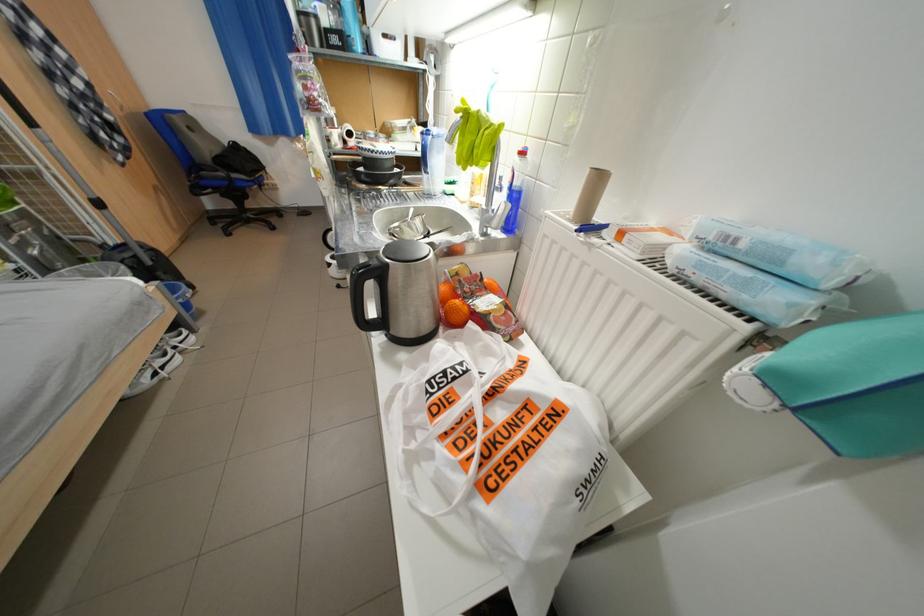
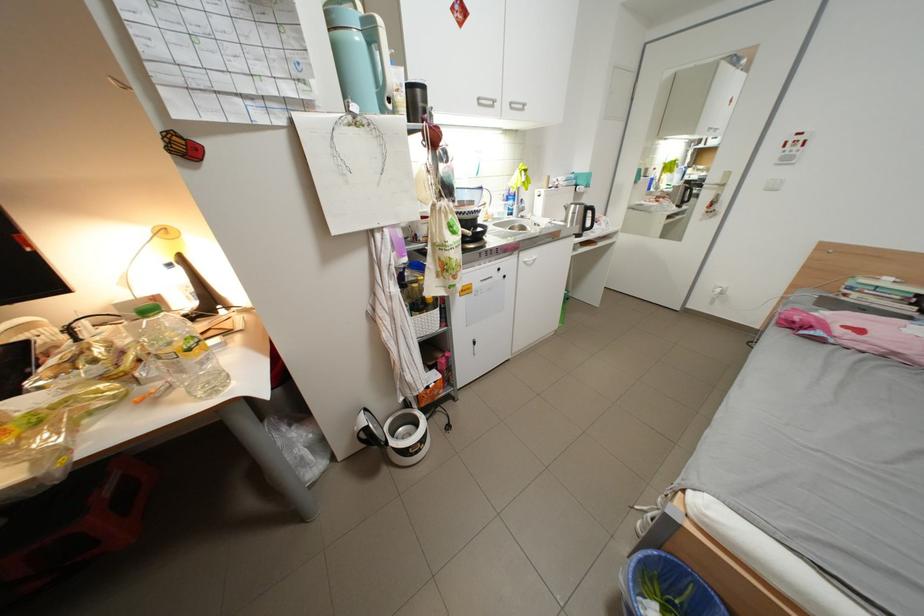
Where in the second image is the point corresponding to pixel 345 254 from the first image?

(404, 444)